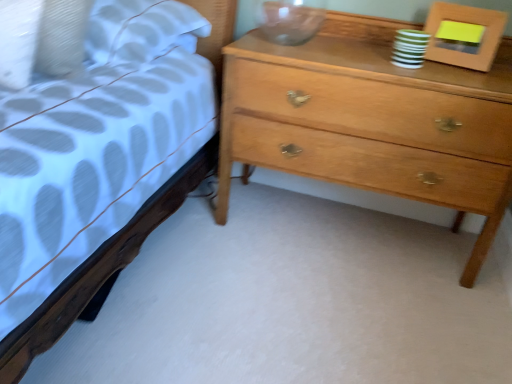
What do you see at coordinates (371, 121) in the screenshot? Image resolution: width=512 pixels, height=384 pixels. I see `light brown wood chest of drawers at right` at bounding box center [371, 121].

The width and height of the screenshot is (512, 384). What are the coordinates of `light brown wood chest of drawers at right` in the screenshot? It's located at (371, 121).

Measure the distance between point [237,83] and camera.

The distance of point [237,83] from camera is 4.68 feet.

In order to face light brown wood chest of drawers at right, should I rotate leftwards or rightwards?

To align with it, rotate right about 13.627°.

This screenshot has width=512, height=384. In order to click on wooden picture frame at upper right in this screenshot , I will do `click(464, 35)`.

In order to face wooden picture frame at upper right, should I rotate leftwards or rightwards?

Turn right by 25.881 degrees to look at wooden picture frame at upper right.

This screenshot has width=512, height=384. Describe the element at coordinates (464, 35) in the screenshot. I see `wooden picture frame at upper right` at that location.

The image size is (512, 384). In order to click on light brown wood chest of drawers at right in this screenshot , I will do `click(371, 121)`.

Which is more to the right, light brown wood chest of drawers at right or wooden picture frame at upper right?

wooden picture frame at upper right.

In the scene shown: Relative to wooden picture frame at upper right, is light brown wood chest of drawers at right in front or behind?

Clearly, light brown wood chest of drawers at right is in front of wooden picture frame at upper right.

Which is behind, point (242, 52) or point (454, 43)?

Point (454, 43)

From the image's perspective, which is below, light brown wood chest of drawers at right or wooden picture frame at upper right?

From the image's view, light brown wood chest of drawers at right is below.

From the picture: From a real-world perspective, is light brown wood chest of drawers at right above or below wooden picture frame at upper right?

In terms of real-world spatial position, light brown wood chest of drawers at right is below wooden picture frame at upper right.

Which of these two, light brown wood chest of drawers at right or wooden picture frame at upper right, is thinner?

Thinner between the two is wooden picture frame at upper right.

Considering the relative sizes of light brown wood chest of drawers at right and wooden picture frame at upper right in the image provided, is light brown wood chest of drawers at right shorter than wooden picture frame at upper right?

No.

Looking at the image, does light brown wood chest of drawers at right seem bigger or smaller compared to wooden picture frame at upper right?

Considering their sizes, light brown wood chest of drawers at right takes up more space than wooden picture frame at upper right.

Is light brown wood chest of drawers at right outside of wooden picture frame at upper right?

light brown wood chest of drawers at right lies outside wooden picture frame at upper right's area.

Is light brown wood chest of drawers at right not close to wooden picture frame at upper right?

No, there isn't a large distance between light brown wood chest of drawers at right and wooden picture frame at upper right.

Is light brown wood chest of drawers at right oriented towards wooden picture frame at upper right?

No.

How many degrees apart are the facing directions of light brown wood chest of drawers at right and wooden picture frame at upper right?

15.4 degrees separate the facing orientations of light brown wood chest of drawers at right and wooden picture frame at upper right.

Find the location of a particular element. The width and height of the screenshot is (512, 384). chest of drawers below the wooden picture frame at upper right (from the image's perspective) is located at coordinates (371, 121).

Which object is positioned more to the right, wooden picture frame at upper right or light brown wood chest of drawers at right?

Positioned to the right is wooden picture frame at upper right.

Is wooden picture frame at upper right positioned in front of light brown wood chest of drawers at right?

No, wooden picture frame at upper right is further to the viewer.

Is point (437, 56) behind point (295, 170)?

No, (437, 56) is in front of (295, 170).

From the image's perspective, is wooden picture frame at upper right positioned above or below light brown wood chest of drawers at right?

Based on their image positions, wooden picture frame at upper right is located above light brown wood chest of drawers at right.

From a real-world perspective, is wooden picture frame at upper right physically located above or below light brown wood chest of drawers at right?

wooden picture frame at upper right is situated higher than light brown wood chest of drawers at right in the real world.

Does wooden picture frame at upper right have a greater width compared to light brown wood chest of drawers at right?

No.

Who is shorter, wooden picture frame at upper right or light brown wood chest of drawers at right?

wooden picture frame at upper right.

Can you confirm if wooden picture frame at upper right is bigger than light brown wood chest of drawers at right?

Actually, wooden picture frame at upper right might be smaller than light brown wood chest of drawers at right.

Do you think wooden picture frame at upper right is within light brown wood chest of drawers at right, or outside of it?

wooden picture frame at upper right exists outside the volume of light brown wood chest of drawers at right.

Are wooden picture frame at upper right and light brown wood chest of drawers at right beside each other?

No, wooden picture frame at upper right is not beside light brown wood chest of drawers at right.

Is wooden picture frame at upper right aimed at light brown wood chest of drawers at right?

No, wooden picture frame at upper right is not turned towards light brown wood chest of drawers at right.

The image size is (512, 384). What are the coordinates of `the chest of drawers lying in front of the wooden picture frame at upper right` in the screenshot? It's located at (371, 121).

Locate an element on the screen. Image resolution: width=512 pixels, height=384 pixels. picture frame behind the light brown wood chest of drawers at right is located at coordinates (464, 35).

I want to click on the chest of drawers below the wooden picture frame at upper right (from a real-world perspective), so click(371, 121).